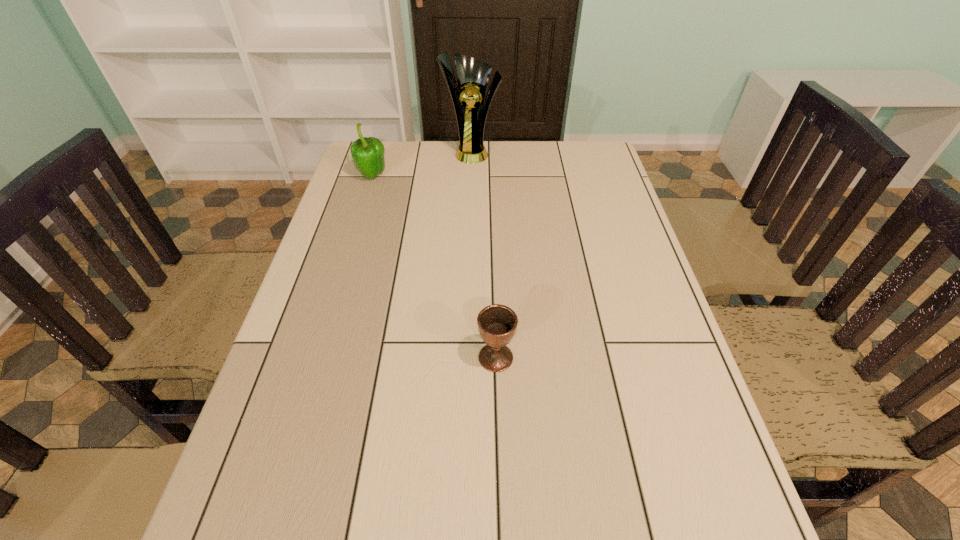
This screenshot has height=540, width=960. In order to click on bell pepper located at the far edge in this screenshot , I will do `click(367, 153)`.

Identify the location of object located in the left edge section of the desktop. This screenshot has width=960, height=540. (367, 153).

You are a GUI agent. You are given a task and a screenshot of the screen. Output one action in this format:
    pyautogui.click(x=<x>, y=<y>)
    Task: Click on the object positioned at the far left corner
    
    Given the screenshot: What is the action you would take?
    pyautogui.click(x=367, y=153)

In the image, there is a desktop. At what (x,y) coordinates should I click in order to perform the action: click on free space at the far edge. Please return your answer as a coordinate pair (x, y). Image resolution: width=960 pixels, height=540 pixels. Looking at the image, I should click on click(x=429, y=143).

Where is `free location at the left edge of the desktop`? The height and width of the screenshot is (540, 960). free location at the left edge of the desktop is located at coordinates (322, 332).

Where is `vacant space at the right edge of the desktop`? The height and width of the screenshot is (540, 960). vacant space at the right edge of the desktop is located at coordinates (617, 264).

In the image, there is a desktop. Identify the location of blank space at the far left corner. (385, 179).

Find the location of a particular element. blank space at the far right corner of the desktop is located at coordinates (593, 153).

Locate an element on the screen. free spot between the award and the leftmost object is located at coordinates (422, 164).

Where is `vacant area that lies between the farthest object and the second nearest object`? This screenshot has width=960, height=540. vacant area that lies between the farthest object and the second nearest object is located at coordinates (422, 164).